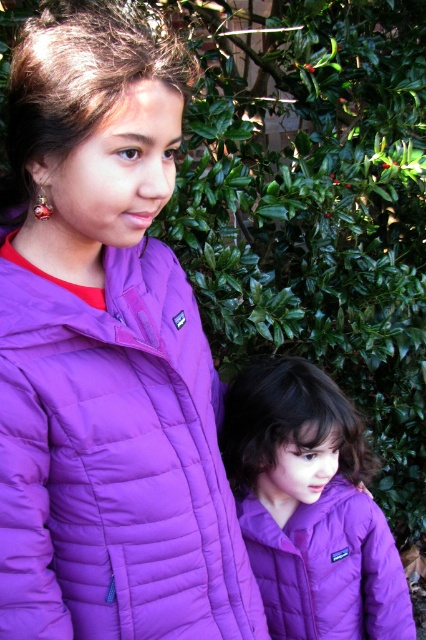
Question: Can you confirm if purple quilted jacket at left is positioned to the right of purple quilted jacket at center?

Choices:
 (A) yes
 (B) no

Answer: (B)

Question: Which object appears closest to the camera in this image?

Choices:
 (A) purple quilted jacket at center
 (B) purple quilted jacket at left

Answer: (B)

Question: Which of the following is the farthest from the observer?

Choices:
 (A) purple quilted jacket at center
 (B) purple quilted jacket at left

Answer: (A)

Question: Is purple quilted jacket at left thinner than purple quilted jacket at center?

Choices:
 (A) no
 (B) yes

Answer: (B)

Question: Can you confirm if purple quilted jacket at left is positioned below purple quilted jacket at center?

Choices:
 (A) yes
 (B) no

Answer: (B)